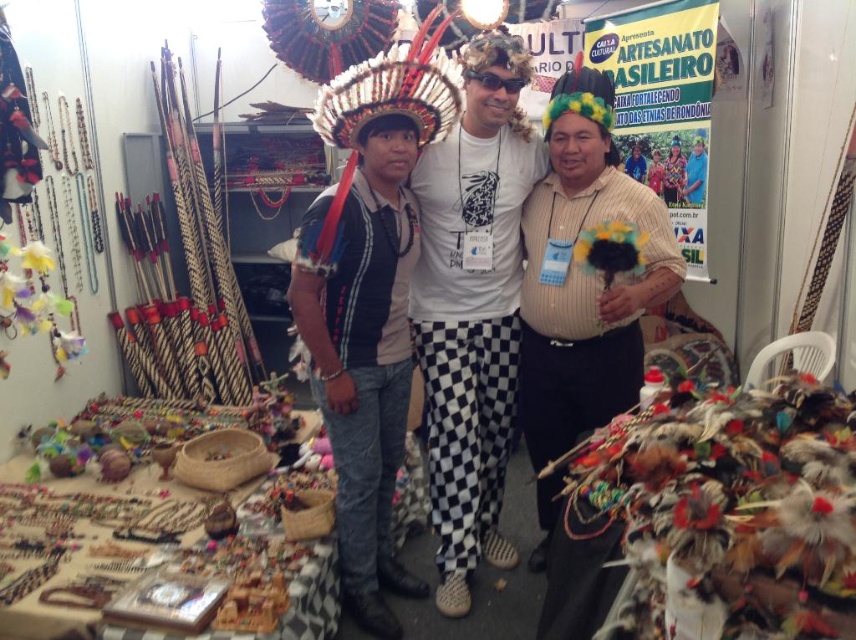
Question: Is matte black shirt at center thinner than shiny metallic headdress at center?

Choices:
 (A) no
 (B) yes

Answer: (B)

Question: Is matte black shirt at center thinner than matte black headdress at center?

Choices:
 (A) yes
 (B) no

Answer: (B)

Question: Which point is farther to the camera?

Choices:
 (A) matte black headdress at center
 (B) matte black shirt at center
 (C) shiny metallic headdress at center

Answer: (A)

Question: Estimate the real-world distances between objects in this image. Which object is farther from the white checkered pants at center?

Choices:
 (A) matte black headdress at center
 (B) matte black jacket at center
 (C) matte black shirt at center
 (D) shiny metallic headdress at center

Answer: (A)

Question: Which of the following is the closest to the observer?

Choices:
 (A) matte black shirt at center
 (B) matte black headdress at center
 (C) white checkered pants at center

Answer: (A)

Question: Does shiny metallic headdress at center appear on the left side of matte black headdress at center?

Choices:
 (A) yes
 (B) no

Answer: (A)